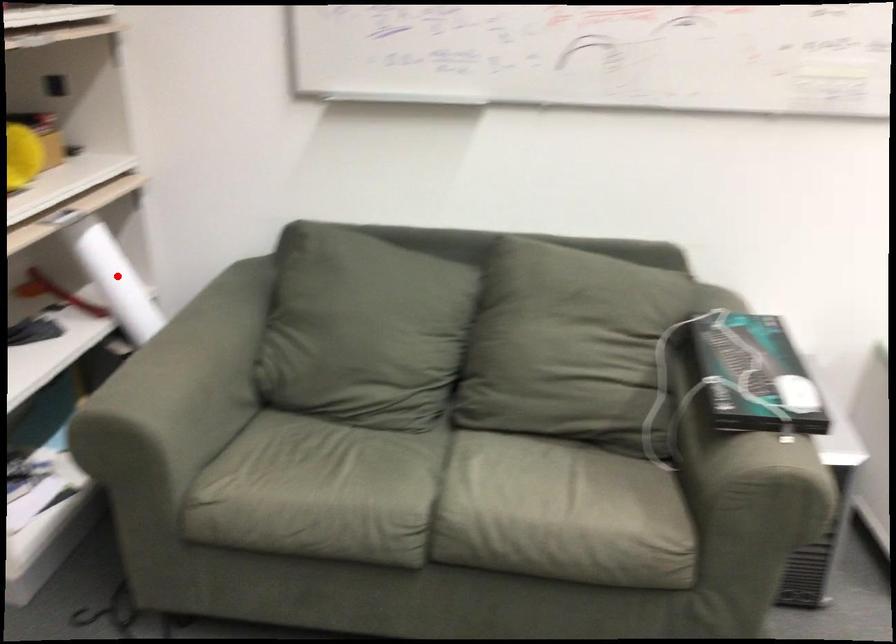
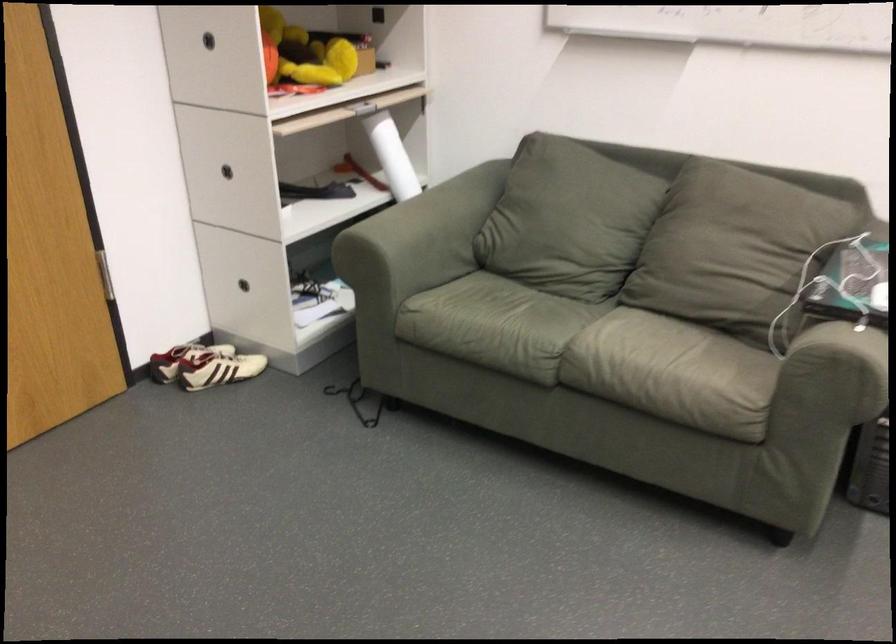
Question: I am providing you with two images of the same scene from different viewpoints. Given a red point in image1, look at the same physical point in image2. Is it:

Choices:
 (A) Closer to the viewpoint
 (B) Farther from the viewpoint

Answer: (B)